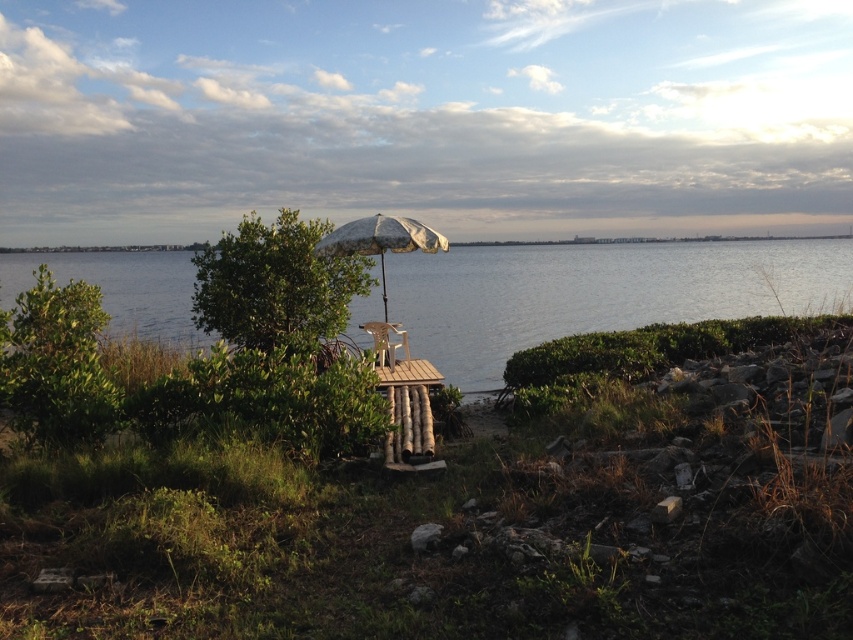
Question: Is green leafy bush at left positioned behind printed fabric umbrella at center?

Choices:
 (A) yes
 (B) no

Answer: (B)

Question: Is clear water at center positioned behind printed fabric umbrella at center?

Choices:
 (A) no
 (B) yes

Answer: (B)

Question: Can you confirm if clear water at center is positioned below green leafy tree at center?

Choices:
 (A) no
 (B) yes

Answer: (A)

Question: Which is farther from the green leafy bush at left?

Choices:
 (A) metallic silver beach chair at center
 (B) printed fabric umbrella at center

Answer: (B)

Question: Which point is closer to the camera taking this photo?

Choices:
 (A) (293, 268)
 (B) (0, 404)
 (C) (404, 339)

Answer: (B)

Question: Which point appears farthest from the camera in this image?

Choices:
 (A) (379, 349)
 (B) (744, 307)
 (C) (283, 216)

Answer: (B)